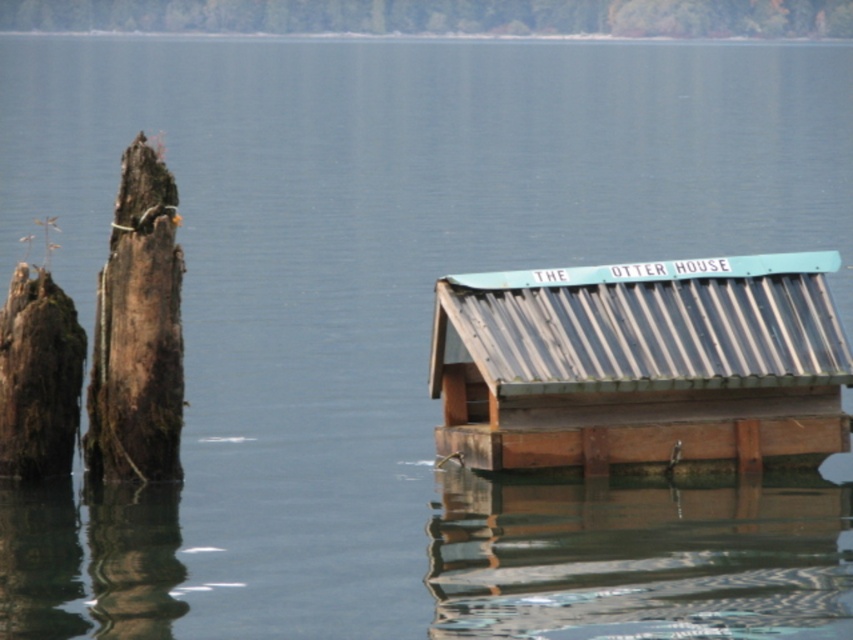
Is metallic corrugated roof at center to the right of dark brown wood at left from the viewer's perspective?

Correct, you'll find metallic corrugated roof at center to the right of dark brown wood at left.

Is metallic corrugated roof at center thinner than dark brown wood at left?

Incorrect, metallic corrugated roof at center's width is not less than dark brown wood at left's.

Which is in front, point (602, 282) or point (173, 458)?

Point (173, 458) is more forward.

Image resolution: width=853 pixels, height=640 pixels. Find the location of `metallic corrugated roof at center`. metallic corrugated roof at center is located at coordinates (640, 364).

Is point (660, 308) less distant than point (62, 300)?

No, it is behind (62, 300).

Which is behind, point (831, 371) or point (21, 371)?

The point (831, 371) is behind.

Locate an element on the screen. The image size is (853, 640). metallic corrugated roof at center is located at coordinates (640, 364).

Is dark brown wood at left shorter than brown rough tree trunk at left?

No.

Is dark brown wood at left thinner than brown rough tree trunk at left?

No, dark brown wood at left is not thinner than brown rough tree trunk at left.

Measure the distance between point (181,385) and camera.

Point (181,385) and camera are 14.18 meters apart.

At what (x,y) coordinates should I click in order to perform the action: click on dark brown wood at left. Please return your answer as a coordinate pair (x, y). The height and width of the screenshot is (640, 853). Looking at the image, I should click on (138, 332).